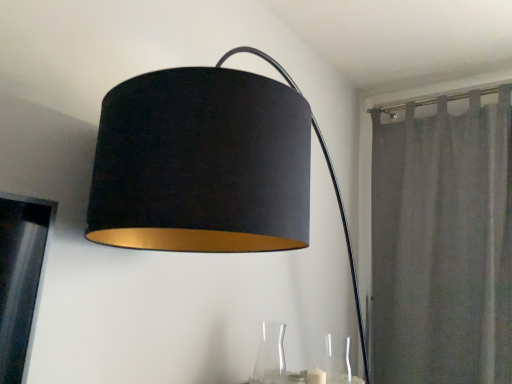
Question: Is gray fabric curtain at right positioned before white matte candle at lower center?

Choices:
 (A) yes
 (B) no

Answer: (B)

Question: Is gray fabric curtain at right oriented away from white matte candle at lower center?

Choices:
 (A) no
 (B) yes

Answer: (A)

Question: Considering the relative positions of gray fabric curtain at right and white matte candle at lower center in the image provided, is gray fabric curtain at right to the left of white matte candle at lower center from the viewer's perspective?

Choices:
 (A) yes
 (B) no

Answer: (B)

Question: Is gray fabric curtain at right taller than white matte candle at lower center?

Choices:
 (A) yes
 (B) no

Answer: (A)

Question: From a real-world perspective, is gray fabric curtain at right positioned over white matte candle at lower center based on gravity?

Choices:
 (A) no
 (B) yes

Answer: (B)

Question: Considering the relative positions of gray fabric curtain at right and white matte candle at lower center in the image provided, is gray fabric curtain at right behind white matte candle at lower center?

Choices:
 (A) yes
 (B) no

Answer: (A)

Question: From the image's perspective, is white matte candle at lower center located beneath gray fabric curtain at right?

Choices:
 (A) no
 (B) yes

Answer: (B)

Question: Is white matte candle at lower center positioned behind gray fabric curtain at right?

Choices:
 (A) yes
 (B) no

Answer: (B)

Question: Is white matte candle at lower center at the left side of gray fabric curtain at right?

Choices:
 (A) yes
 (B) no

Answer: (A)

Question: Considering the relative sizes of white matte candle at lower center and gray fabric curtain at right in the image provided, is white matte candle at lower center smaller than gray fabric curtain at right?

Choices:
 (A) yes
 (B) no

Answer: (A)

Question: From a real-world perspective, is white matte candle at lower center under gray fabric curtain at right?

Choices:
 (A) no
 (B) yes

Answer: (B)

Question: Is white matte candle at lower center in front of gray fabric curtain at right?

Choices:
 (A) no
 (B) yes

Answer: (B)

Question: Considering the relative sizes of transparent glass vase at lower right, arranged as the 1th glass vase when viewed from the right, and transparent glass vase at lower center, which is the 2th glass vase from right to left, in the image provided, is transparent glass vase at lower right, arranged as the 1th glass vase when viewed from the right, wider than transparent glass vase at lower center, which is the 2th glass vase from right to left,?

Choices:
 (A) yes
 (B) no

Answer: (B)